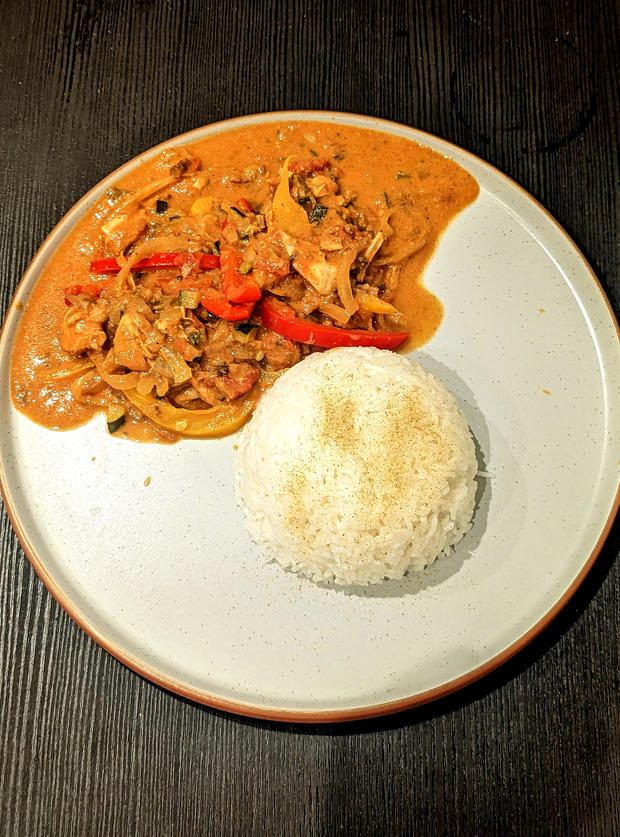
Identify the location of black table. (590, 805).